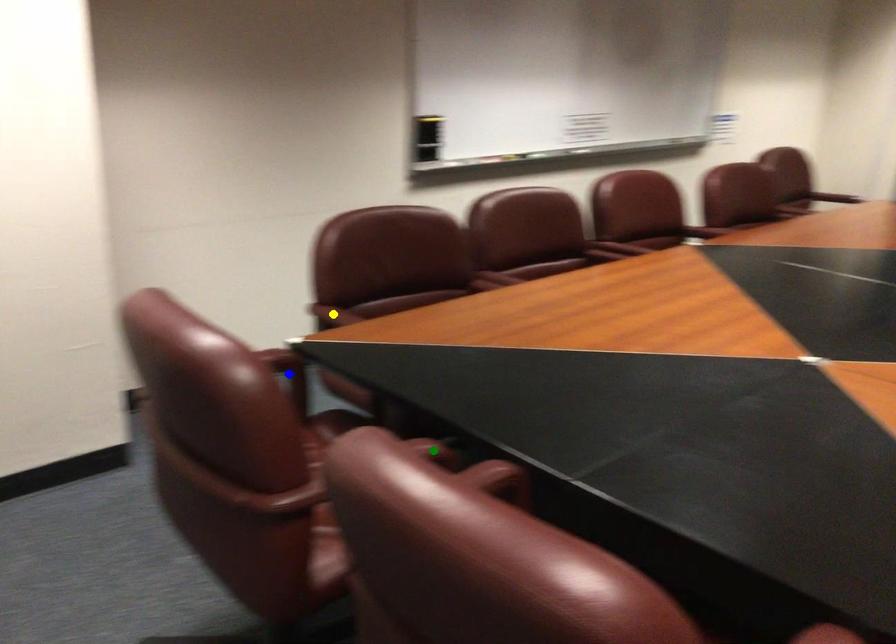
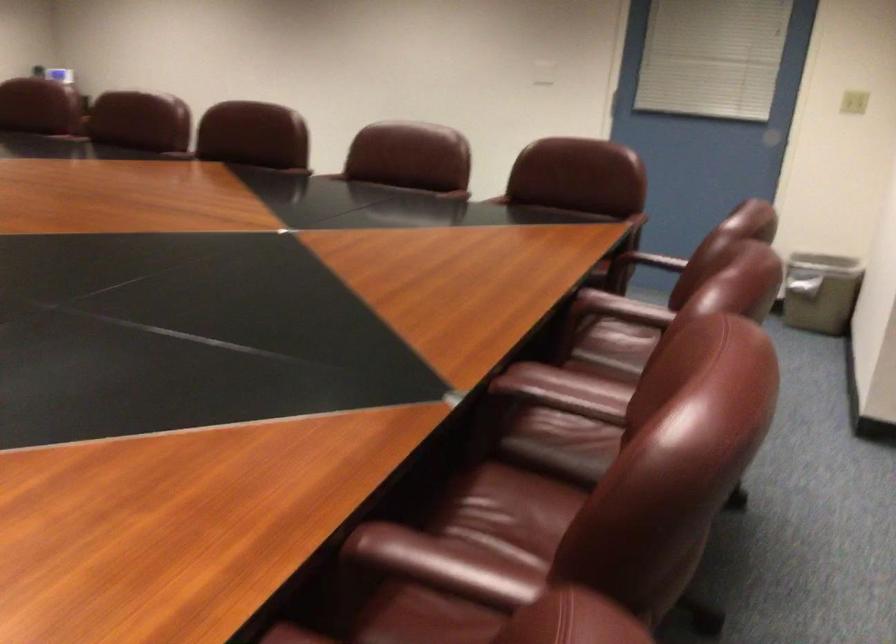
I am providing you with two images of the same scene from different viewpoints. Three points are marked in image1. Which point corresponds to a part or object that is occluded in image2?In image1, three points are marked. Which of them correspond to a part or object that is occluded in image2?Among the three points shown in image1, which one corresponds to a part or object that is no longer visible due to occlusion in image2?

yellow point, green point, blue point cannot be seen in image2.